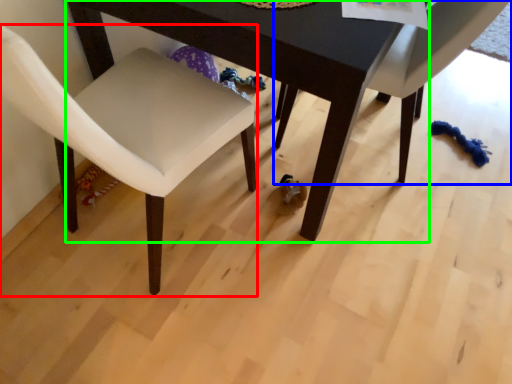
Question: Estimate the real-world distances between objects in this image. Which object is closer to chair (highlighted by a red box), chair (highlighted by a blue box) or table (highlighted by a green box)?

Choices:
 (A) chair
 (B) table

Answer: (B)